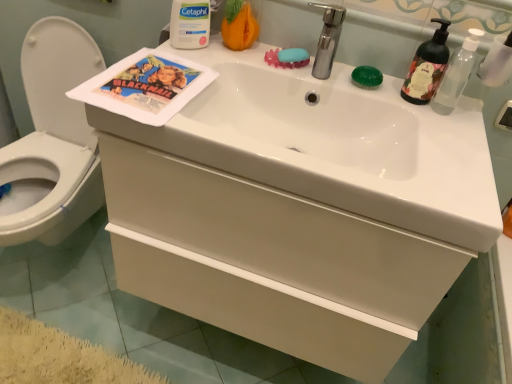
Image resolution: width=512 pixels, height=384 pixels. Describe the element at coordinates (456, 74) in the screenshot. I see `translucent plastic pump bottle at upper right` at that location.

The height and width of the screenshot is (384, 512). What do you see at coordinates (293, 55) in the screenshot? I see `blue matte soap at upper center, which is the second soap from right to left` at bounding box center [293, 55].

What do you see at coordinates (190, 24) in the screenshot? I see `white matte cetaphil container at upper center` at bounding box center [190, 24].

Locate an element on the screen. white matte cetaphil container at upper center is located at coordinates (190, 24).

Measure the distance between silver metallic faucet at upper center and camera.

1.04 meters.

Identify the location of white glossy toilet at left. The width and height of the screenshot is (512, 384). (53, 139).

Would you say translucent plastic pump bottle at upper right is to the left or to the right of green matte soap dispenser at upper right in the picture?

Based on their positions, translucent plastic pump bottle at upper right is located to the right of green matte soap dispenser at upper right.

Is translucent plastic pump bottle at upper right next to green matte soap dispenser at upper right?

Indeed, translucent plastic pump bottle at upper right and green matte soap dispenser at upper right are beside each other and touching.

How different are the orientations of translucent plastic pump bottle at upper right and green matte soap dispenser at upper right in degrees?

translucent plastic pump bottle at upper right and green matte soap dispenser at upper right are facing 6.39e-05 degrees away from each other.

From the image's perspective, would you say translucent plastic pump bottle at upper right is positioned over green matte soap dispenser at upper right?

Incorrect, from the image's perspective, translucent plastic pump bottle at upper right is lower than green matte soap dispenser at upper right.

From a real-world perspective, is white matte drawer at center positioned over blue matte soap at upper center, the first soap positioned from the left, based on gravity?

Actually, white matte drawer at center is physically below blue matte soap at upper center, the first soap positioned from the left, in the real world.

How many degrees apart are the facing directions of white matte drawer at center and blue matte soap at upper center, the first soap positioned from the left?

23.1 degrees separate the facing orientations of white matte drawer at center and blue matte soap at upper center, the first soap positioned from the left.

In the scene shown: Is white matte drawer at center looking in the opposite direction of blue matte soap at upper center, the first soap positioned from the left?

No, white matte drawer at center is not facing away from blue matte soap at upper center, the first soap positioned from the left.

From the picture: How far apart are white matte drawer at center and blue matte soap at upper center, which is the second soap from right to left?

white matte drawer at center is 20.52 inches away from blue matte soap at upper center, which is the second soap from right to left.

Between silver metallic faucet at upper center and white glossy sink at center, which one has larger width?

Wider between the two is white glossy sink at center.

Between silver metallic faucet at upper center and white glossy sink at center, which one has larger size?

white glossy sink at center.

Based on their positions, is silver metallic faucet at upper center located to the left or right of white glossy sink at center?

From the image, it's evident that silver metallic faucet at upper center is to the right of white glossy sink at center.

Measure the distance between silver metallic faucet at upper center and white glossy sink at center.

silver metallic faucet at upper center is 9.93 inches from white glossy sink at center.

From a real-world perspective, relative to green matte soap at upper right, the 1th soap in the right-to-left sequence, is white matte drawer at center vertically above or below?

In terms of real-world spatial position, white matte drawer at center is below green matte soap at upper right, the 1th soap in the right-to-left sequence.

Consider the image. Is white matte drawer at center oriented towards green matte soap at upper right, the 1th soap in the right-to-left sequence?

Answer: No.

From the picture: Is white matte drawer at center in front of or behind green matte soap at upper right, the 1th soap in the right-to-left sequence, in the image?

In the image, white matte drawer at center appears in front of green matte soap at upper right, the 1th soap in the right-to-left sequence.

Consider the image. Is white matte drawer at center thinner than green matte soap at upper right, the 1th soap in the right-to-left sequence?

No, white matte drawer at center is not thinner than green matte soap at upper right, the 1th soap in the right-to-left sequence.

Which object is more forward, white glossy toilet at left or green matte soap dispenser at upper right?

white glossy toilet at left is closer to the camera.

Who is taller, white glossy toilet at left or green matte soap dispenser at upper right?

white glossy toilet at left is taller.

Is point (16, 242) in front of point (412, 73)?

No, it is behind (412, 73).

Considering the relative positions of blue matte soap at upper center, which is the second soap from right to left, and translucent plastic pump bottle at upper right in the image provided, is blue matte soap at upper center, which is the second soap from right to left, behind translucent plastic pump bottle at upper right?

Yes, the depth of blue matte soap at upper center, which is the second soap from right to left, is greater than that of translucent plastic pump bottle at upper right.

Is blue matte soap at upper center, the first soap positioned from the left, facing away from translucent plastic pump bottle at upper right?

blue matte soap at upper center, the first soap positioned from the left, is not turned away from translucent plastic pump bottle at upper right.

Which soap is the 2nd one when counting from the left side of the translucent plastic pump bottle at upper right? Please provide its 2D coordinates.

[(293, 55)]

From the image's perspective, is blue matte soap at upper center, which is the second soap from right to left, located above translucent plastic pump bottle at upper right?

Indeed, from the image's perspective, blue matte soap at upper center, which is the second soap from right to left, is shown above translucent plastic pump bottle at upper right.

Which is behind, green matte soap dispenser at upper right or white matte cetaphil container at upper center?

white matte cetaphil container at upper center.

From the image's perspective, is green matte soap dispenser at upper right positioned above or below white matte cetaphil container at upper center?

green matte soap dispenser at upper right is below white matte cetaphil container at upper center.

I want to click on soap dispenser that is under the white matte cetaphil container at upper center (from a real-world perspective), so click(426, 67).

At what (x,y) coordinates should I click in order to perform the action: click on soap dispenser behind the translucent plastic pump bottle at upper right. Please return your answer as a coordinate pair (x, y). This screenshot has width=512, height=384. Looking at the image, I should click on (426, 67).

From a real-world perspective, which soap is the 2nd one above the white matte drawer at center? Please provide its 2D coordinates.

[(293, 55)]

When comparing their distances from white glossy toilet at left, does white matte cetaphil container at upper center or white matte drawer at center seem closer?

white matte cetaphil container at upper center.

Based on the photo, based on their spatial positions, is white glossy toilet at left or white matte drawer at center further from white glossy sink at center?

white glossy toilet at left is positioned further to the anchor white glossy sink at center.

Which object lies nearer to the anchor point white matte cetaphil container at upper center, white glossy sink at center or green matte soap at upper right, acting as the second soap starting from the left?

white glossy sink at center is positioned closer to the anchor white matte cetaphil container at upper center.

Looking at the image, which one is located closer to white glossy sink at center, white matte drawer at center or silver metallic faucet at upper center?

Among the two, white matte drawer at center is located nearer to white glossy sink at center.

From the image, which object appears to be nearer to translucent plastic pump bottle at upper right, silver metallic faucet at upper center or white glossy toilet at left?

Among the two, silver metallic faucet at upper center is located nearer to translucent plastic pump bottle at upper right.

Based on the photo, based on their spatial positions, is white matte cetaphil container at upper center or silver metallic faucet at upper center further from blue matte soap at upper center, the first soap positioned from the left?

white matte cetaphil container at upper center is further to blue matte soap at upper center, the first soap positioned from the left.

Estimate the real-world distances between objects in this image. Which object is further from translucent plastic pump bottle at upper right, white glossy toilet at left or green matte soap at upper right, acting as the second soap starting from the left?

white glossy toilet at left.

Based on their spatial positions, is silver metallic faucet at upper center or white matte drawer at center further from blue matte soap at upper center, the first soap positioned from the left?

The object further to blue matte soap at upper center, the first soap positioned from the left, is white matte drawer at center.

This screenshot has width=512, height=384. I want to click on soap dispenser between silver metallic faucet at upper center and white matte drawer at center in the up-down direction, so tap(426, 67).

The width and height of the screenshot is (512, 384). What are the coordinates of `tap between white glossy sink at center and blue matte soap at upper center, which is the second soap from right to left, along the z-axis` in the screenshot? It's located at (328, 39).

Locate an element on the screen. Image resolution: width=512 pixels, height=384 pixels. drawer between white glossy toilet at left and white glossy sink at center in the horizontal direction is located at coordinates (278, 237).

Identify the location of soap between silver metallic faucet at upper center and white matte drawer at center in the vertical direction. This screenshot has width=512, height=384. (367, 77).